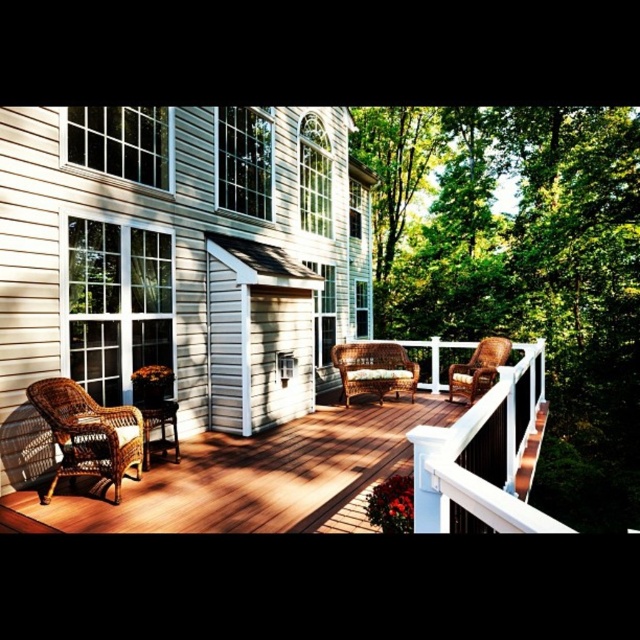
In the scene shown: You are standing on the deck and want to move from the woven wicker chairs at lower left to the woven brown wicker settee at center. Which direction should you move to get closer to the settee?

You should move towards the woven brown wicker settee at center by going away from the viewer since the woven wicker chairs at lower left is closer to the viewer than the settee.